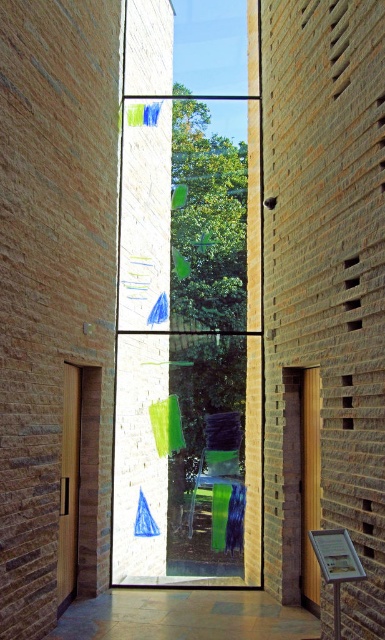
Which is in front, point (199, 259) or point (75, 449)?

Point (75, 449) is more forward.

Is transparent glass window at center smaller than wooden door at left?

Yes, transparent glass window at center is smaller than wooden door at left.

Is point (257, 48) positioned in front of point (93, 502)?

No, it is behind (93, 502).

Where is `transparent glass window at center`? Image resolution: width=385 pixels, height=640 pixels. transparent glass window at center is located at coordinates (189, 298).

Does wooden door at left appear on the right side of green fabric chair at center?

In fact, wooden door at left is to the left of green fabric chair at center.

Between point (56, 572) and point (187, 531), which one is positioned behind?

Positioned behind is point (187, 531).

At what (x,y) coordinates should I click in order to perform the action: click on wooden door at left. Please return your answer as a coordinate pair (x, y). The height and width of the screenshot is (640, 385). Looking at the image, I should click on click(x=78, y=484).

Who is more forward, (x=229, y=419) or (x=229, y=433)?

Point (x=229, y=433) is more forward.

Image resolution: width=385 pixels, height=640 pixels. Identify the location of transparent glass window at center. click(x=189, y=298).